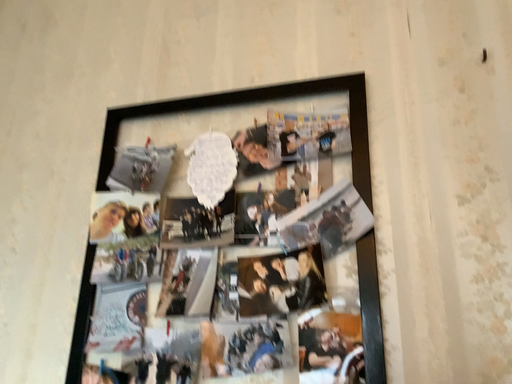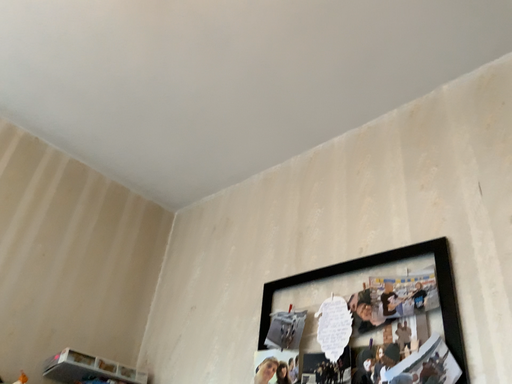
Question: Which way did the camera rotate in the video?

Choices:
 (A) rotated upward
 (B) rotated downward

Answer: (A)